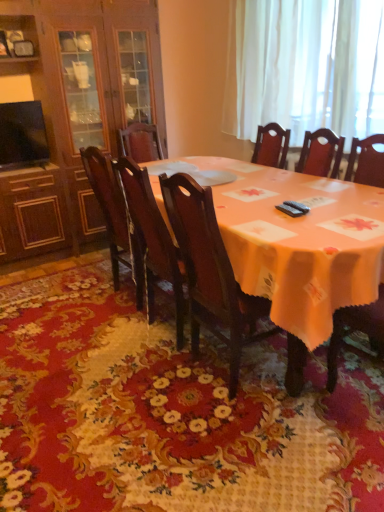
Where is `free point to the left of polished dark wood chair at center, which ranks as the 3th chair in right-to-left order`? free point to the left of polished dark wood chair at center, which ranks as the 3th chair in right-to-left order is located at coordinates (77, 302).